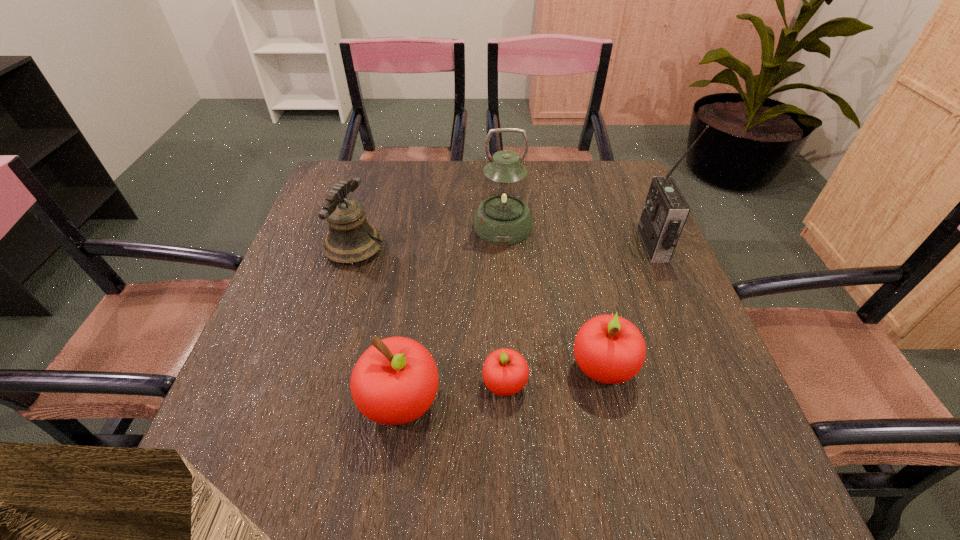
Locate an element on the screen. Image resolution: width=960 pixels, height=540 pixels. free space that is in between the second tallest object and the leftmost apple is located at coordinates (452, 314).

Locate an element on the screen. free spot between the leftmost apple and the leftmost object is located at coordinates (377, 325).

Where is `empty space that is in between the bell and the shortest object`? empty space that is in between the bell and the shortest object is located at coordinates (429, 316).

Locate an element on the screen. The image size is (960, 540). free space between the second tallest object and the fifth object from right to left is located at coordinates click(x=452, y=314).

Find the location of `free space between the second tallest object and the rightmost apple`. free space between the second tallest object and the rightmost apple is located at coordinates (553, 296).

Locate an element on the screen. The width and height of the screenshot is (960, 540). free spot between the radio receiver and the fifth object from left to right is located at coordinates (628, 306).

Point out which object is positioned as the nearest to the leftmost apple. Please provide its 2D coordinates. Your answer should be formatted as a tuple, i.e. [(x, y)], where the tuple contains the x and y coordinates of a point satisfying the conditions above.

[(505, 371)]

I want to click on object that is the fourth closest to the shortest object, so click(x=349, y=240).

Find the location of a particular element. This screenshot has height=540, width=960. the closest apple relative to the rightmost object is located at coordinates (609, 349).

Point out which apple is positioned as the nearest to the fifth object from left to right. Please provide its 2D coordinates. Your answer should be formatted as a tuple, i.e. [(x, y)], where the tuple contains the x and y coordinates of a point satisfying the conditions above.

[(505, 371)]